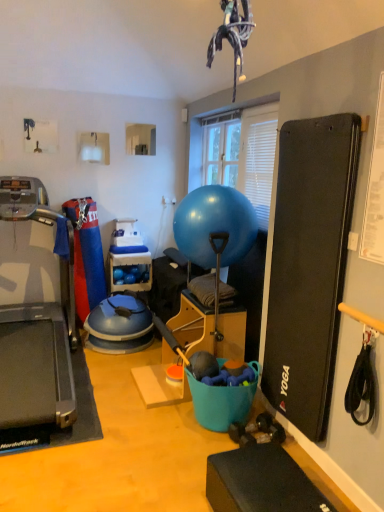
Find the location of a particular element. The image size is (384, 512). black rubber treadmill at left is located at coordinates (36, 371).

Describe the element at coordinates (130, 272) in the screenshot. I see `blue plastic shelf at center` at that location.

Find the location of a particular element. black rubber treadmill at left is located at coordinates (36, 371).

Could you tell me if black rubber treadmill at left is turned towards glossy rubber ball at center?

No, black rubber treadmill at left is not facing towards glossy rubber ball at center.

In the image, there is a black rubber treadmill at left. At what (x,y) coordinates should I click in order to perform the action: click on ball above it (from the image's perspective). Please return your answer as a coordinate pair (x, y). The width and height of the screenshot is (384, 512). Looking at the image, I should click on (214, 226).

Which is more to the left, black rubber treadmill at left or glossy rubber ball at center?

black rubber treadmill at left is more to the left.

Is blue plastic shelf at center turned away from black rubber treadmill at left?

blue plastic shelf at center is not turned away from black rubber treadmill at left.

The width and height of the screenshot is (384, 512). Find the location of `shelf below the black rubber treadmill at left (from the image's perspective)`. shelf below the black rubber treadmill at left (from the image's perspective) is located at coordinates (130, 272).

Is the surface of blue plastic shelf at center in direct contact with black rubber treadmill at left?

No, blue plastic shelf at center is not in contact with black rubber treadmill at left.

Is glossy rubber ball at center oriented away from blue plastic shelf at center?

No, glossy rubber ball at center is not facing away from blue plastic shelf at center.

Looking at this image, can you confirm if glossy rubber ball at center is wider than blue plastic shelf at center?

Yes, glossy rubber ball at center is wider than blue plastic shelf at center.

In terms of height, does glossy rubber ball at center look taller or shorter compared to blue plastic shelf at center?

Considering their sizes, glossy rubber ball at center has more height than blue plastic shelf at center.

Does black rubber treadmill at left have a lesser width compared to blue plastic shelf at center?

No.

Is point (27, 186) closer or farther from the camera than point (146, 287)?

Point (27, 186) appears to be closer to the viewer than point (146, 287).

From a real-world perspective, which is physically above, black rubber treadmill at left or blue plastic shelf at center?

black rubber treadmill at left.

Based on the photo, in terms of height, does black rubber treadmill at left look taller or shorter compared to blue plastic shelf at center?

In the image, black rubber treadmill at left appears to be taller than blue plastic shelf at center.

Is blue plastic shelf at center further to the viewer compared to glossy rubber ball at center?

Yes, it is.

Is blue plastic shelf at center inside or outside of glossy rubber ball at center?

blue plastic shelf at center cannot be found inside glossy rubber ball at center.

Is blue plastic shelf at center far away from glossy rubber ball at center?

Yes, blue plastic shelf at center and glossy rubber ball at center are located far from each other.

Is blue plastic shelf at center facing away from glossy rubber ball at center?

blue plastic shelf at center does not have its back to glossy rubber ball at center.

Relative to black rubber treadmill at left, is glossy rubber ball at center in front or behind?

glossy rubber ball at center is behind black rubber treadmill at left.

Considering the positions of objects glossy rubber ball at center and black rubber treadmill at left in the image provided, who is more to the left, glossy rubber ball at center or black rubber treadmill at left?

Positioned to the left is black rubber treadmill at left.

Is glossy rubber ball at center completely or partially outside of black rubber treadmill at left?

Yes, glossy rubber ball at center is not within black rubber treadmill at left.

Between glossy rubber ball at center and black rubber treadmill at left, which one has smaller size?

glossy rubber ball at center is smaller.

The height and width of the screenshot is (512, 384). I want to click on treadmill in front of the glossy rubber ball at center, so click(x=36, y=371).

Where is `shelf below the black rubber treadmill at left (from a real-world perspective)`? shelf below the black rubber treadmill at left (from a real-world perspective) is located at coordinates (130, 272).

From the image, which object appears to be farther from glossy rubber ball at center, blue plastic shelf at center or black rubber treadmill at left?

blue plastic shelf at center is positioned further to the anchor glossy rubber ball at center.

Considering their positions, is glossy rubber ball at center positioned closer to blue plastic shelf at center than black rubber treadmill at left?

Based on the image, black rubber treadmill at left appears to be nearer to blue plastic shelf at center.

From the image, which object appears to be nearer to black rubber treadmill at left, blue plastic shelf at center or glossy rubber ball at center?

blue plastic shelf at center is closer to black rubber treadmill at left.

Based on their spatial positions, is black rubber treadmill at left or blue plastic shelf at center closer to glossy rubber ball at center?

black rubber treadmill at left is closer to glossy rubber ball at center.

Estimate the real-world distances between objects in this image. Which object is closer to blue plastic shelf at center, black rubber treadmill at left or glossy rubber ball at center?

Among the two, black rubber treadmill at left is located nearer to blue plastic shelf at center.

Based on their spatial positions, is glossy rubber ball at center or blue plastic shelf at center further from black rubber treadmill at left?

Based on the image, glossy rubber ball at center appears to be further to black rubber treadmill at left.

Find the location of a particular element. ball positioned between black rubber treadmill at left and blue plastic shelf at center from near to far is located at coordinates (214, 226).